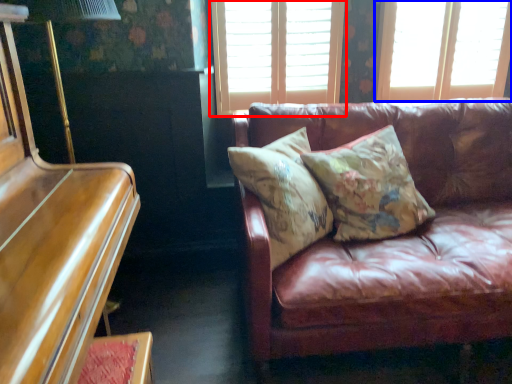
Question: Which object is closer to the camera taking this photo, window (highlighted by a red box) or window (highlighted by a blue box)?

Choices:
 (A) window
 (B) window

Answer: (A)